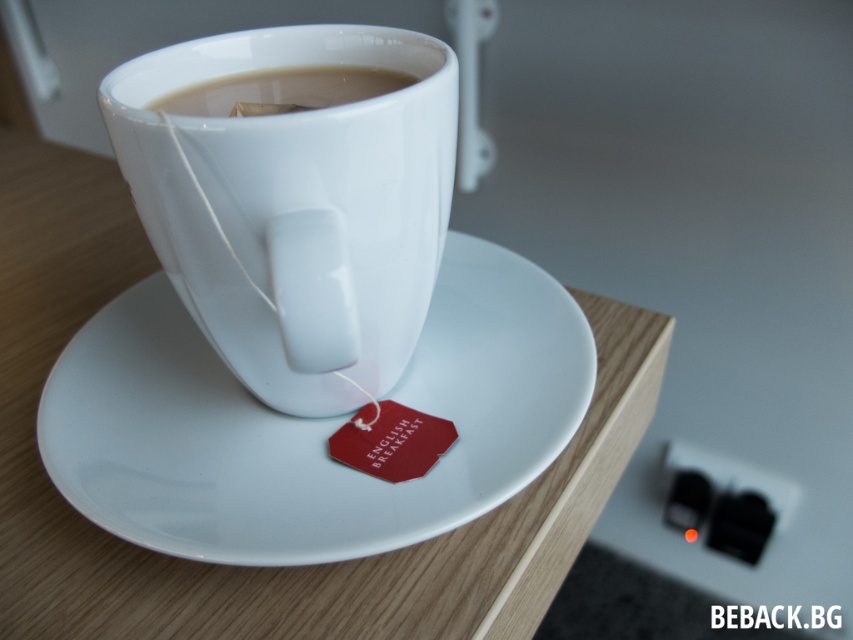
Question: Can you confirm if white glossy mug at center is positioned below white glossy cup at upper center?

Choices:
 (A) yes
 (B) no

Answer: (A)

Question: Can you confirm if white glossy mug at center is smaller than white glossy cup at upper center?

Choices:
 (A) yes
 (B) no

Answer: (B)

Question: Which object is positioned farthest from the white ceramic saucer at center?

Choices:
 (A) white glossy mug at center
 (B) white glossy cup at upper center

Answer: (B)

Question: Estimate the real-world distances between objects in this image. Which object is closer to the white ceramic saucer at center?

Choices:
 (A) white glossy cup at upper center
 (B) white glossy mug at center

Answer: (B)

Question: In this image, where is white ceramic saucer at center located relative to white glossy cup at upper center?

Choices:
 (A) above
 (B) below

Answer: (B)

Question: Which point is farther to the camera?

Choices:
 (A) (425, 348)
 (B) (282, 74)

Answer: (A)